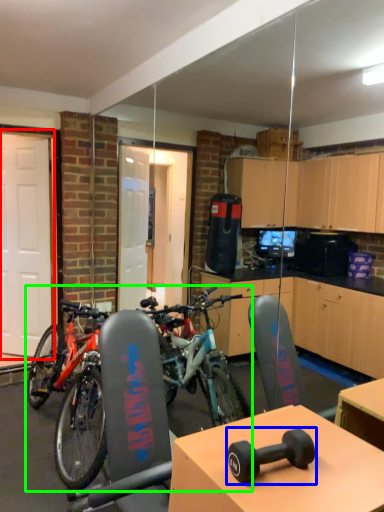
Question: Which object is the closest to the garage door (highlighted by a red box)? Choose among these: dumbbell (highlighted by a blue box) or bicycle (highlighted by a green box).

Choices:
 (A) dumbbell
 (B) bicycle

Answer: (B)